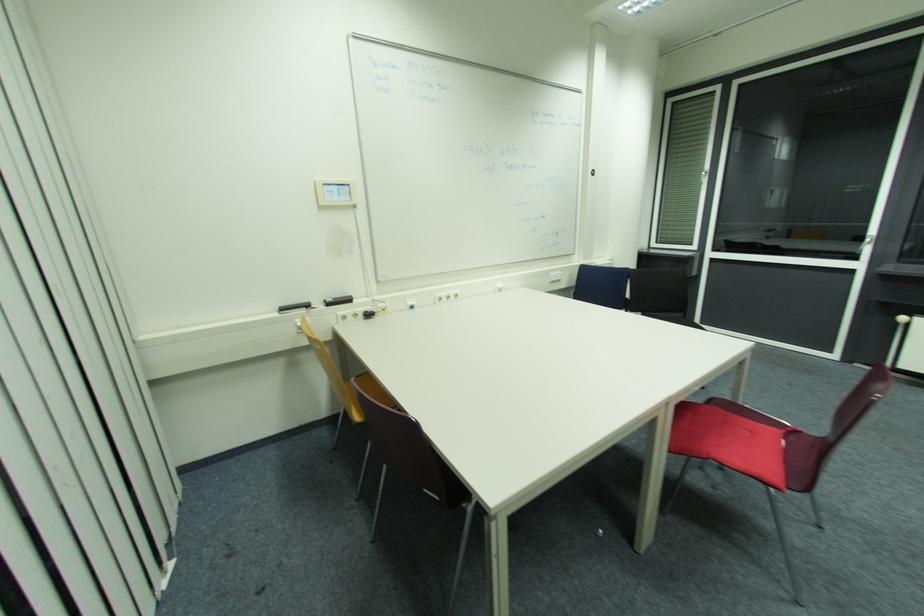
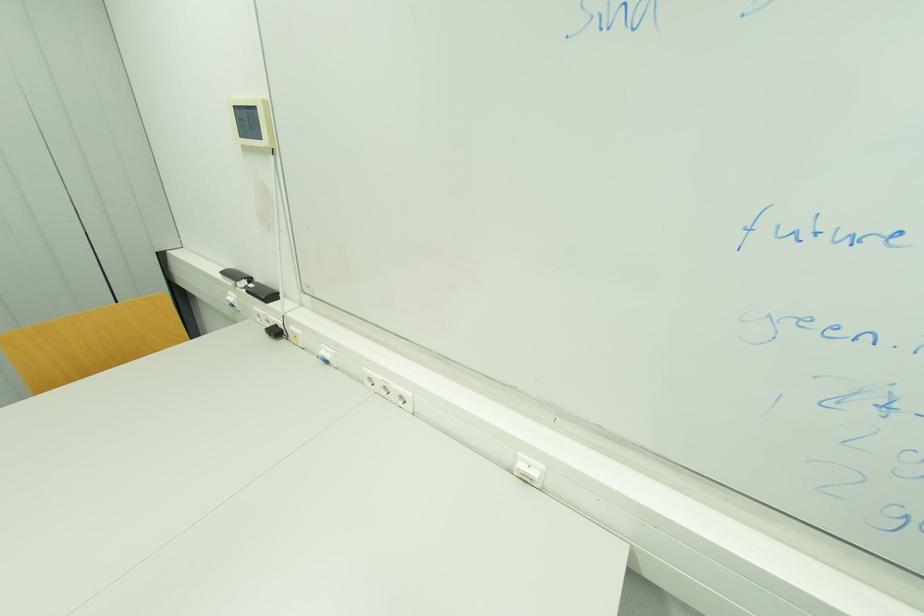
Find the pixel in the second image that matches point (329, 185) in the first image.

(237, 108)